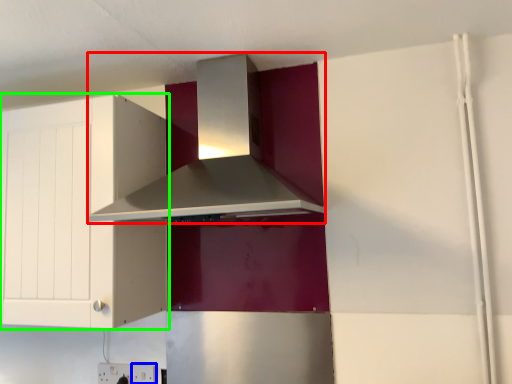
Question: Which object is positioned farthest from home appliance (highlighted by a red box)? Select from electric outlet (highlighted by a blue box) and cabinetry (highlighted by a green box).

Choices:
 (A) electric outlet
 (B) cabinetry

Answer: (A)